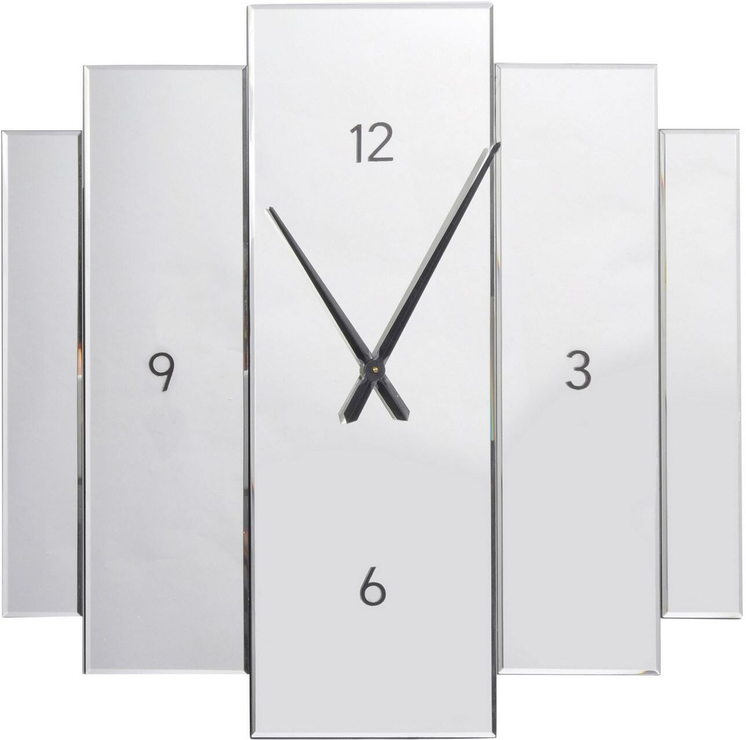
Where is `glass`? The width and height of the screenshot is (746, 740). glass is located at coordinates (482, 575).